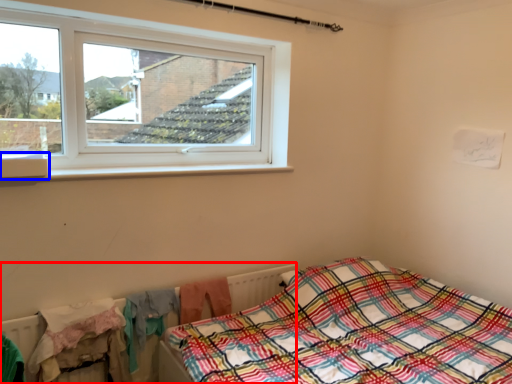
Question: Which of the following is the farthest to the observer, radiator (highlighted by a red box) or window sill (highlighted by a blue box)?

Choices:
 (A) radiator
 (B) window sill

Answer: (A)